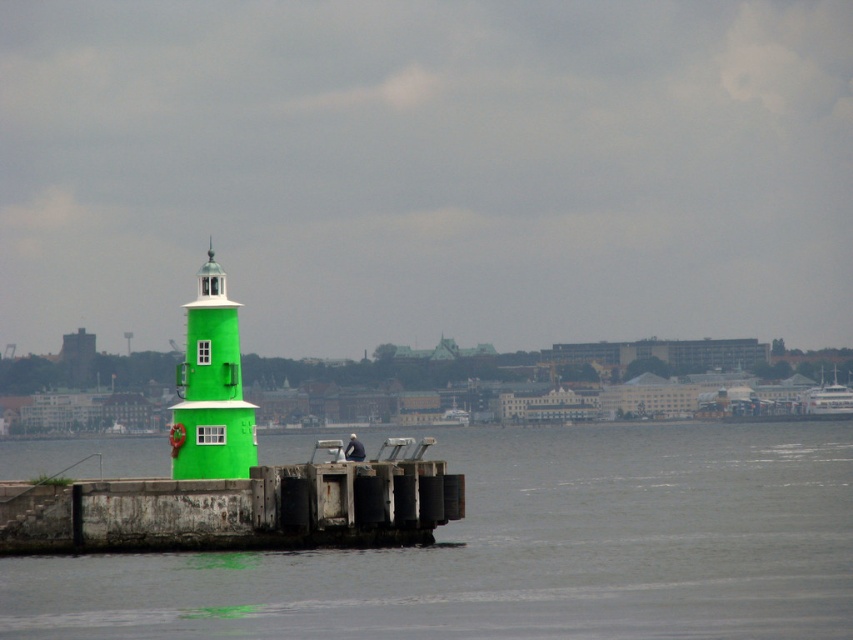
You are a photographer trying to capture the green concrete water at center and the white glossy boat at upper right in a single frame. Which object should you focus on first if you want to include both in your shot without zooming in or out?

The green concrete water at center has a larger size compared to the white glossy boat at upper right, so you should focus on the green concrete water at center first to ensure it fits in the frame before adjusting for the smaller boat.